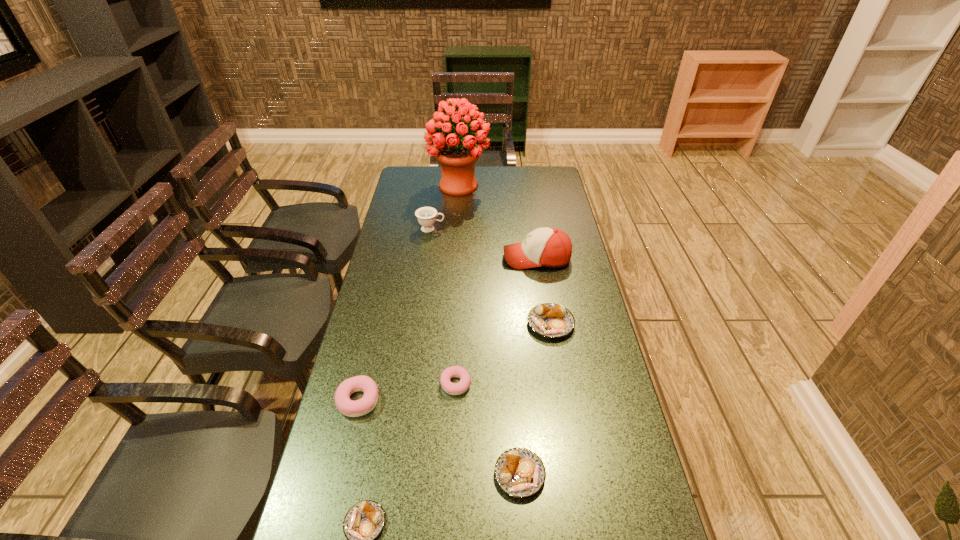
In the image, there is a desktop. What are the coordinates of `free region at the left edge` in the screenshot? It's located at (341, 451).

In order to click on vacant space at the right edge of the desktop in this screenshot , I will do (607, 353).

This screenshot has height=540, width=960. Identify the location of vacant space at the far left corner. (399, 187).

At what (x,y) coordinates should I click in order to perform the action: click on vacant space at the far right corner. Please return your answer as a coordinate pair (x, y). Looking at the image, I should click on (554, 190).

Where is `blank region between the third pastry from left to right and the farthest object`? blank region between the third pastry from left to right and the farthest object is located at coordinates (457, 285).

Locate an element on the screen. The height and width of the screenshot is (540, 960). free space between the seventh farthest object and the bouquet is located at coordinates (490, 330).

Image resolution: width=960 pixels, height=540 pixels. I want to click on empty location between the second farthest object and the right pink pastry, so click(444, 307).

This screenshot has width=960, height=540. What are the coordinates of `unoccupied position between the fourth farthest pastry and the left pink pastry` in the screenshot? It's located at (439, 437).

Identify the location of free space that is in between the second tallest object and the biggest brown pastry. The width and height of the screenshot is (960, 540). (543, 291).

Where is `free space between the left pink pastry and the baseball cap`? The width and height of the screenshot is (960, 540). free space between the left pink pastry and the baseball cap is located at coordinates (447, 329).